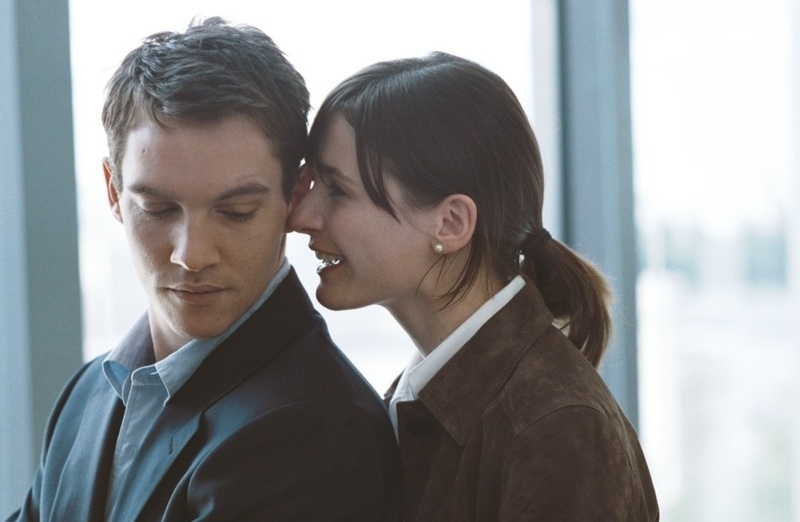
You are a GUI agent. You are given a task and a screenshot of the screen. Output one action in this format:
    pyautogui.click(x=<x>, y=<y>)
    Task: Click on the window
    
    Given the screenshot: What is the action you would take?
    pyautogui.click(x=354, y=35)